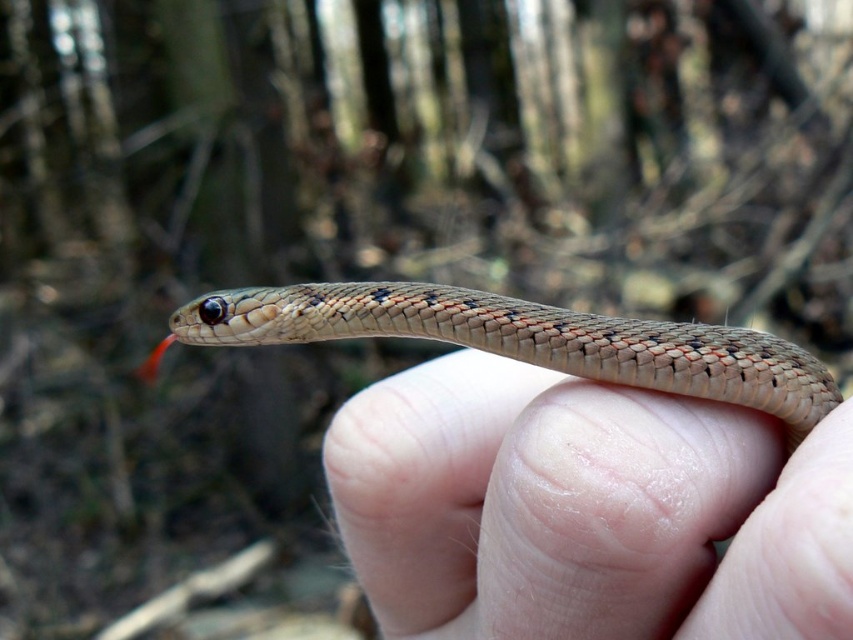
You are a biologist observing a snake in a forest setting. You notice two features at the center of the image. One is the smooth skin at center and the other is the speckled scales snake at center. According to the image, which of these two features is positioned to the right of the other?

The smooth skin at center is to the right of the speckled scales snake at center.

You are a wildlife photographer focusing on the speckled scales snake at center and the smooth skin at center. Which object is positioned lower in the image?

The smooth skin at center is positioned below the speckled scales snake at center, so the smooth skin at center is lower in the image.

You are a wildlife photographer trying to capture the texture details of the smooth skin at center and the speckled scales snake at center. Which object has a thinner surface?

The smooth skin at center is thinner than the speckled scales snake at center according to the description.